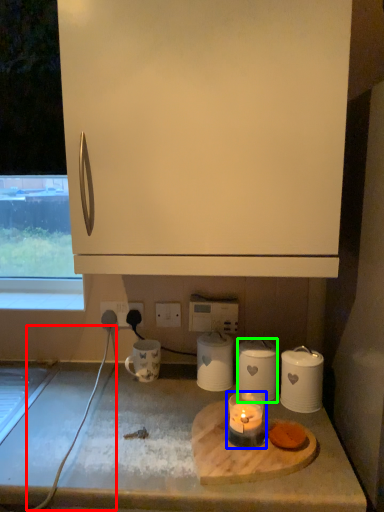
Question: Which object is the closest to the wire (highlighted by a red box)? Choose among these: candle holder (highlighted by a blue box) or kitchen appliance (highlighted by a green box).

Choices:
 (A) candle holder
 (B) kitchen appliance

Answer: (A)